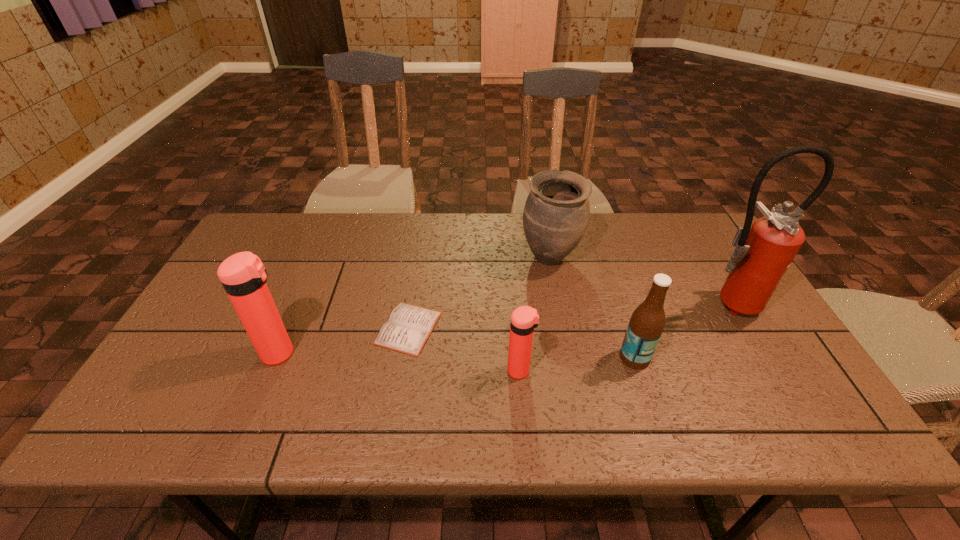
Please point a spot to add another thermos bottle on the right. Please provide its 2D coordinates. Your answer should be formatted as a tuple, i.e. [(x, y)], where the tuple contains the x and y coordinates of a point satisfying the conditions above.

[(779, 389)]